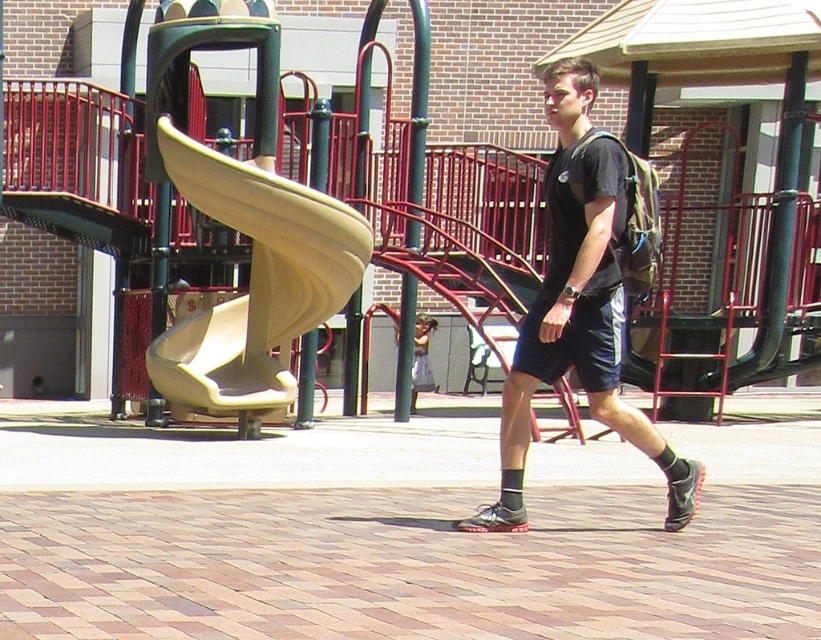
Question: Among these objects, which one is farthest from the camera?

Choices:
 (A) matte black t-shirt at center
 (B) tan rubber slide at left

Answer: (B)

Question: Does matte black t-shirt at center have a larger size compared to tan rubber slide at left?

Choices:
 (A) no
 (B) yes

Answer: (A)

Question: Can you confirm if matte black t-shirt at center is positioned below tan rubber slide at left?

Choices:
 (A) no
 (B) yes

Answer: (B)

Question: Which point is closer to the camera?

Choices:
 (A) (365, 268)
 (B) (508, 529)

Answer: (B)

Question: Is matte black t-shirt at center to the right of tan rubber slide at left from the viewer's perspective?

Choices:
 (A) yes
 (B) no

Answer: (A)